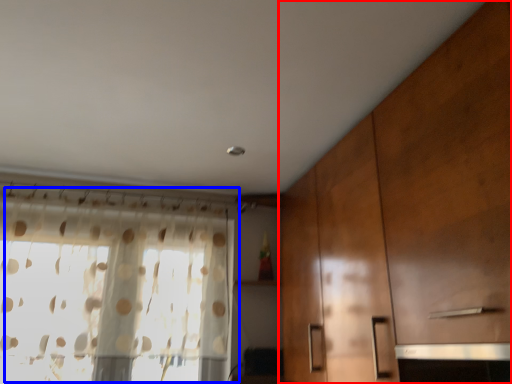
Question: Which object appears closest to the camera in this image, cabinetry (highlighted by a red box) or window (highlighted by a blue box)?

Choices:
 (A) cabinetry
 (B) window

Answer: (A)